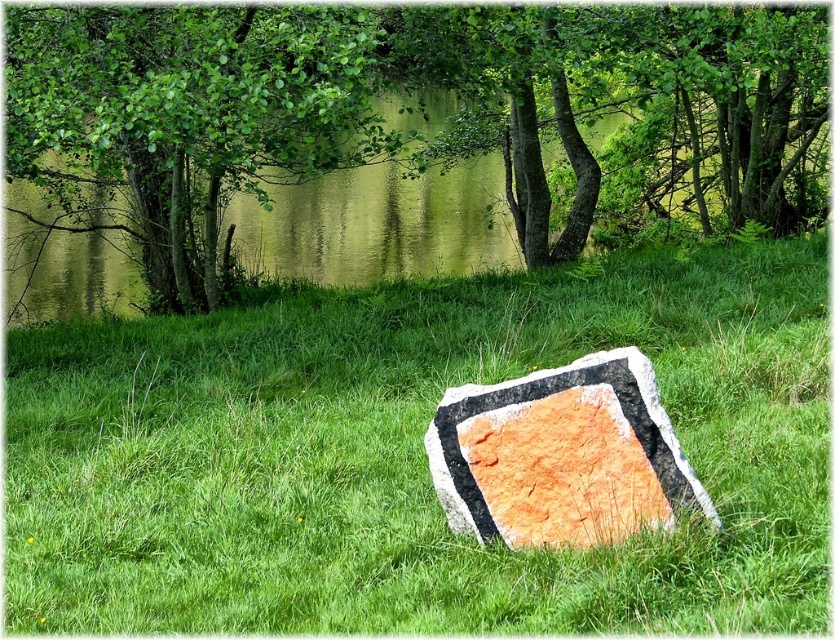
From the picture: Is orange stone at center positioned at the back of orange textured stone at center?

Yes, orange stone at center is further from the viewer.

Which is behind, point (200, 416) or point (472, 420)?

Positioned behind is point (200, 416).

Who is more distant from viewer, (x=134, y=326) or (x=515, y=492)?

Positioned behind is point (x=134, y=326).

I want to click on orange stone at center, so click(413, 456).

Can you confirm if orange stone at center is bigger than green leafy tree at upper left?

Actually, orange stone at center might be smaller than green leafy tree at upper left.

Which of these two, orange stone at center or green leafy tree at upper left, stands taller?

Standing taller between the two is green leafy tree at upper left.

The image size is (835, 640). Describe the element at coordinates (413, 456) in the screenshot. I see `orange stone at center` at that location.

The height and width of the screenshot is (640, 835). I want to click on orange stone at center, so click(x=413, y=456).

Is green leafy tree at upper center to the left of orange textured stone at center from the viewer's perspective?

Correct, you'll find green leafy tree at upper center to the left of orange textured stone at center.

Between point (164, 248) and point (591, 442), which one is positioned in front?

Point (591, 442) is more forward.

Find the location of a particular element. green leafy tree at upper center is located at coordinates (397, 112).